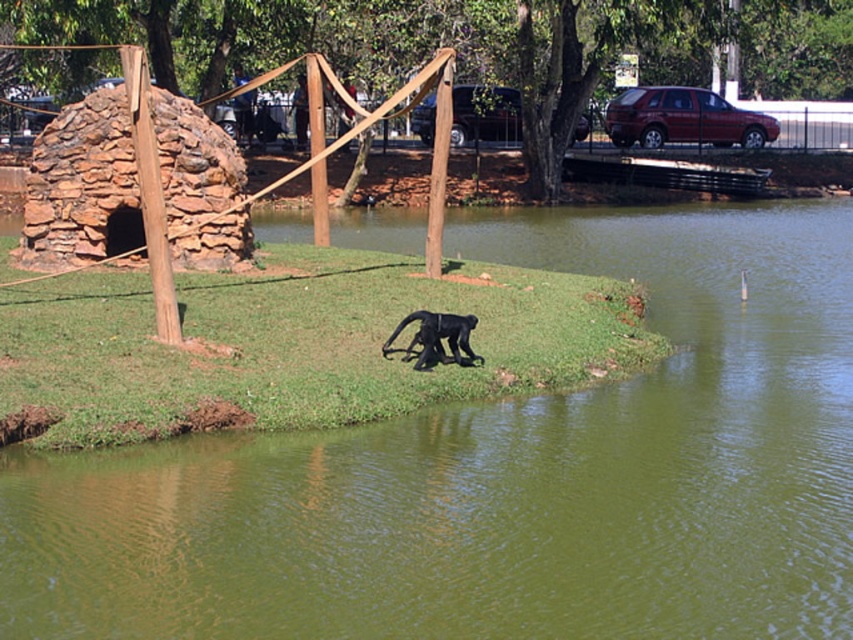
You are standing on the wooden bridge surrounding the green grassy island at center and want to observe the dark gray fur monkey at center. Which direction should you look to see the monkey?

Since the green grassy island at center is closer to the viewer than the dark gray fur monkey at center, you should look towards the center of the island where the monkey is located, as it is positioned further back on the island compared to your vantage point on the bridge.

You are standing on the wooden bridge surrounding the green grassy island at center and want to get to the dark gray fur monkey at center. Which direction should you walk to reach it?

Since the green grassy island at center is to the right of the dark gray fur monkey at center, you should walk to the left to reach it.